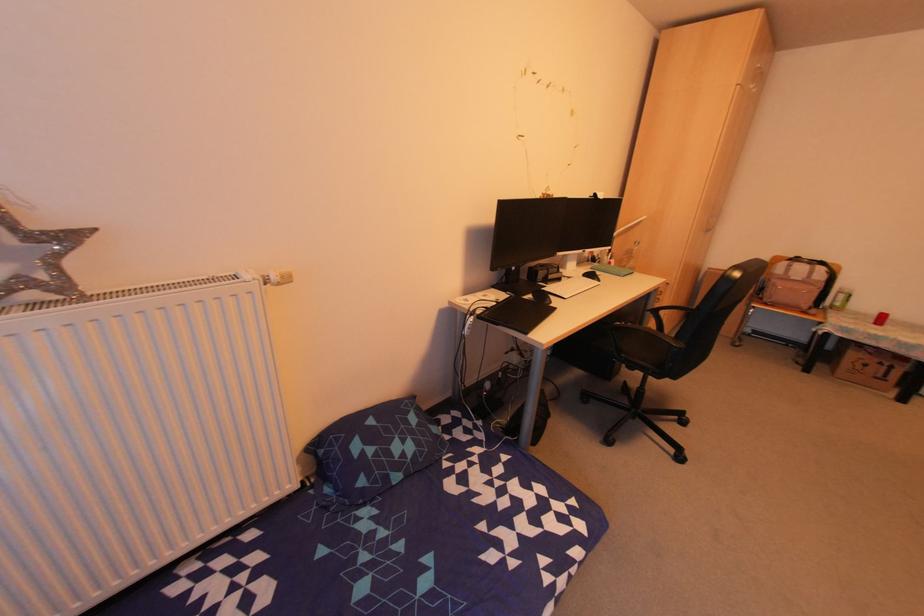
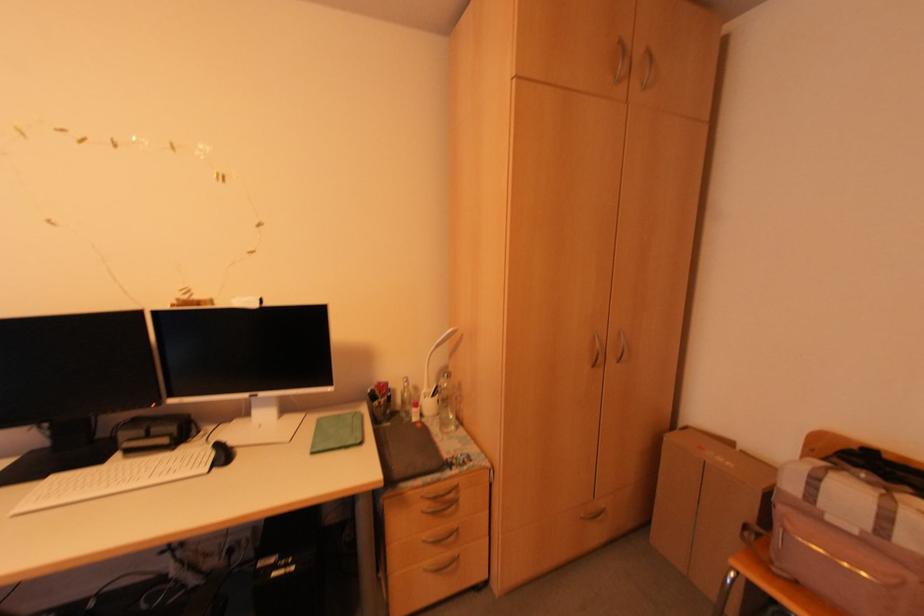
In a continuous first-person perspective shot, in which direction is the camera moving?

The movement direction of the cameraman is right, forward.